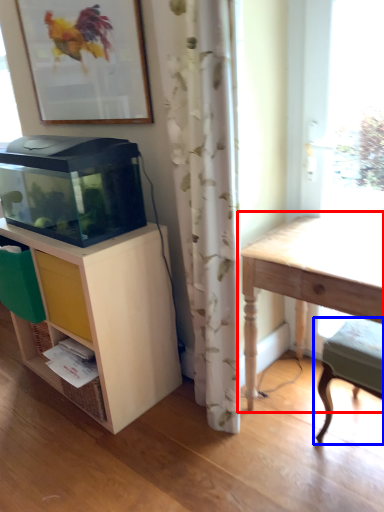
Question: Which object appears farthest to the camera in this image, table (highlighted by a red box) or step stool (highlighted by a blue box)?

Choices:
 (A) table
 (B) step stool

Answer: (B)